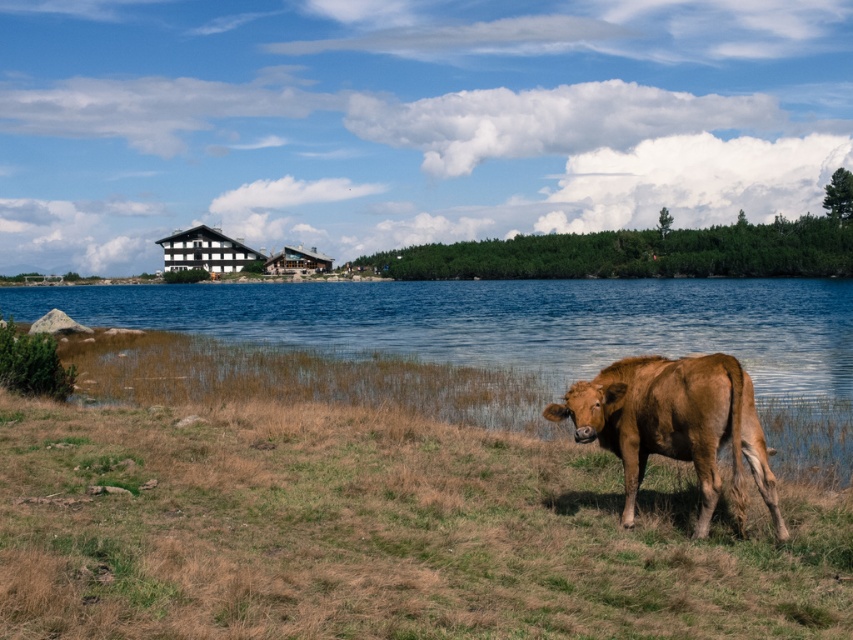
Looking at this image, you are a photographer standing at the edge of the brown grassy at lower right, and you want to take a photo of the brown glossy bull at lower right. Since the bull is facing towards you, will the bull be fully visible in your photo? Explain why based on their positions and heights.

The brown grassy at lower right is shorter than the brown glossy bull at lower right. Since you are standing on the grassy area, the bull will be fully visible as its height is greater than the grass, so there will be no obstruction.

You are a photographer standing at the edge of the scene. You want to capture a photo of the brown grassy at lower right and the brown glossy bull at lower right. Which object should you focus on first to ensure it appears sharp in the photo?

The brown grassy at lower right is in front of the brown glossy bull at lower right, so you should focus on the brown grassy at lower right first to ensure it appears sharp in the photo.